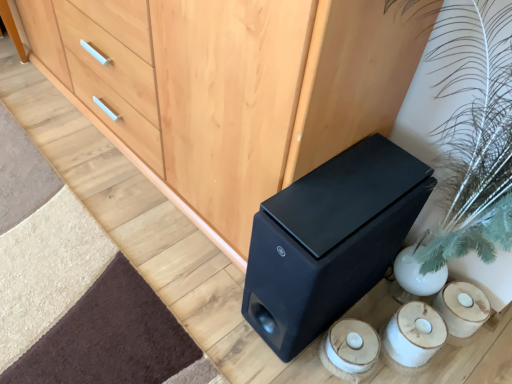
Where is `vacant area situated to the left side of white ceramic candle holder at lower right`? This screenshot has height=384, width=512. vacant area situated to the left side of white ceramic candle holder at lower right is located at coordinates (278, 360).